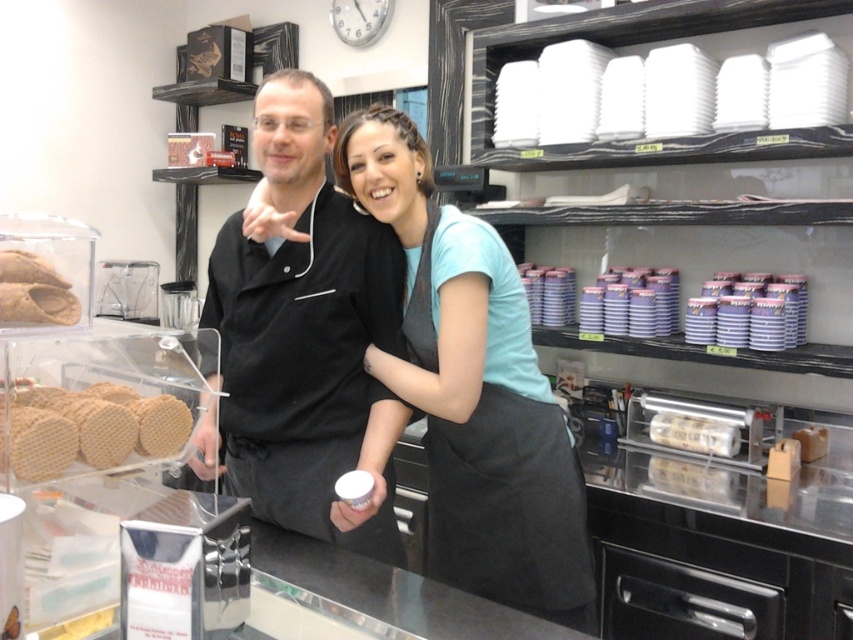
You are a customer at the bakery and want to see both the light blue fabric apron at center and the brown matte bread at center. Which one is closer to you?

The light blue fabric apron at center is closer to you since it is in front of the brown matte bread at center.

You are a customer at the bakery and want to take a photo of the brown matte bread at center without covering any part of it. Is the light blue fabric apron at center currently blocking your view?

The light blue fabric apron at center is positioned over brown matte bread at center, so it is blocking the view of the brown matte bread at center. Move the apron or adjust your angle to capture the bread without obstruction.